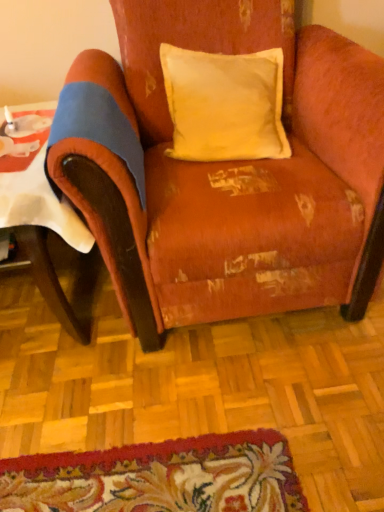
Question: Is white paper at left inside or outside of worn velvet armchair at center?

Choices:
 (A) outside
 (B) inside

Answer: (A)

Question: Considering the positions of white paper at left and worn velvet armchair at center in the image, is white paper at left bigger or smaller than worn velvet armchair at center?

Choices:
 (A) big
 (B) small

Answer: (B)

Question: Based on their relative distances, which object is nearer to the white paper at left?

Choices:
 (A) worn velvet armchair at center
 (B) yellow velvet pillow at upper center

Answer: (A)

Question: Estimate the real-world distances between objects in this image. Which object is closer to the worn velvet armchair at center?

Choices:
 (A) yellow velvet pillow at upper center
 (B) white paper at left

Answer: (A)